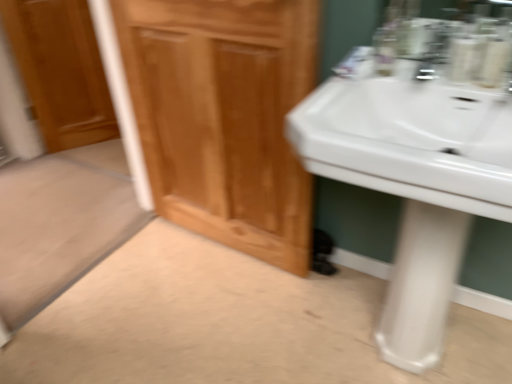
Identify the location of vacant space situated on the left part of wooden cabinet at center. The width and height of the screenshot is (512, 384). (139, 276).